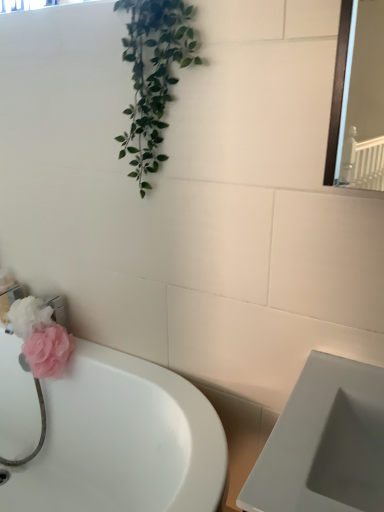
Question: Is pink fabric flower at lower left situated inside white glossy bathtub at lower left or outside?

Choices:
 (A) outside
 (B) inside

Answer: (B)

Question: In terms of size, does pink fabric flower at lower left appear bigger or smaller than white glossy bathtub at lower left?

Choices:
 (A) small
 (B) big

Answer: (A)

Question: Relative to white glossy bathtub at lower left, is pink fabric flower at lower left in front or behind?

Choices:
 (A) front
 (B) behind

Answer: (B)

Question: From the image's perspective, is white glossy bathtub at lower left located above or below pink fabric flower at lower left?

Choices:
 (A) above
 (B) below

Answer: (B)

Question: Is white glossy bathtub at lower left taller or shorter than pink fabric flower at lower left?

Choices:
 (A) short
 (B) tall

Answer: (B)

Question: Considering the positions of white glossy bathtub at lower left and pink fabric flower at lower left in the image, is white glossy bathtub at lower left wider or thinner than pink fabric flower at lower left?

Choices:
 (A) wide
 (B) thin

Answer: (A)

Question: From a real-world perspective, relative to pink fabric flower at lower left, is white glossy bathtub at lower left vertically above or below?

Choices:
 (A) below
 (B) above

Answer: (A)